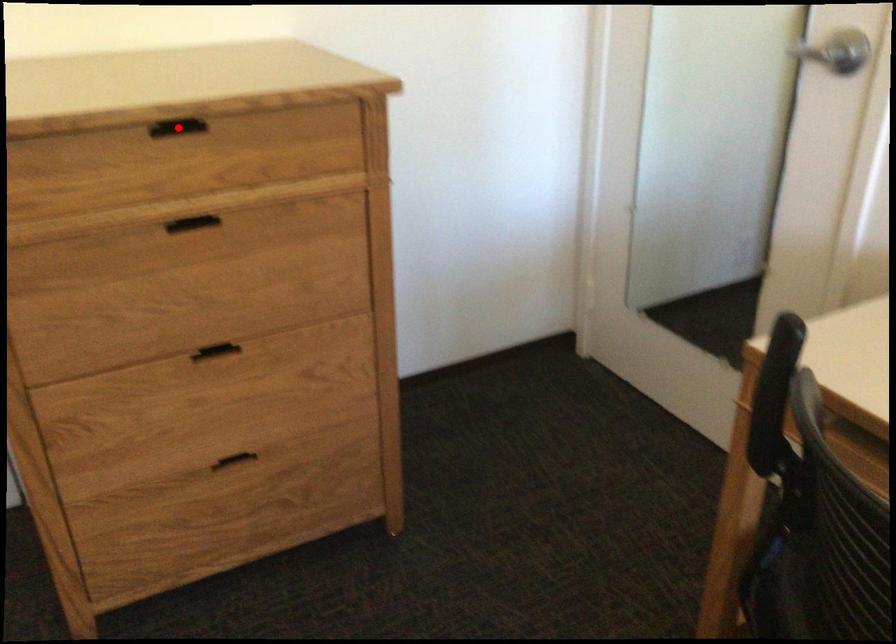
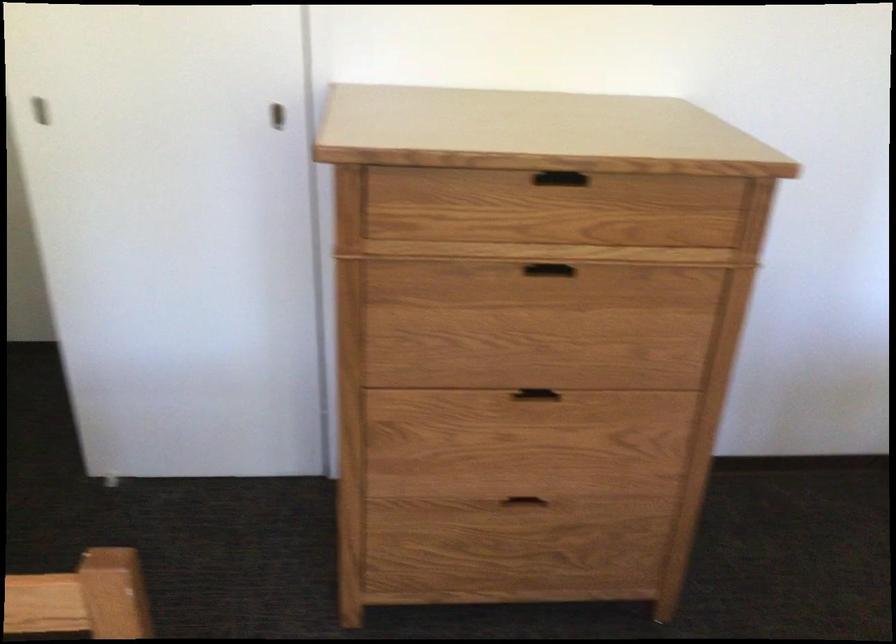
Find the pixel in the second image that matches the highlighted location in the first image.

(549, 167)